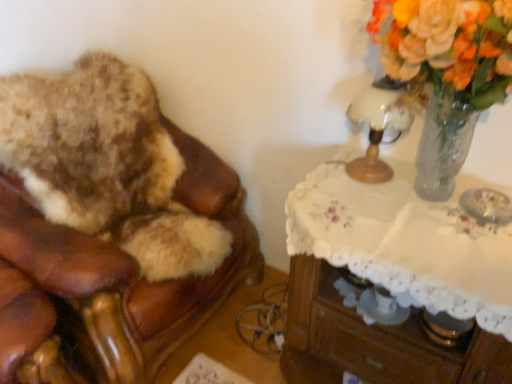
Locate an element on the screen. The height and width of the screenshot is (384, 512). brown leather chair at left is located at coordinates pyautogui.click(x=108, y=228).

Locate an element on the screen. white lace-covered table at upper right is located at coordinates (392, 282).

Who is smaller, white glass table lamp at upper right or brown leather chair at left?

white glass table lamp at upper right.

Are white glass table lamp at upper right and brown leather chair at left far apart?

white glass table lamp at upper right is actually quite close to brown leather chair at left.

Based on the photo, which is closer, (409, 107) or (207, 205)?

The point (409, 107) is closer to the camera.

In the scene shown: From a real-world perspective, is white glass table lamp at upper right located higher than brown leather chair at left?

Yes, from a real-world perspective, white glass table lamp at upper right is on top of brown leather chair at left.

In terms of height, does white glass table lamp at upper right look taller or shorter compared to white lace-covered table at upper right?

Considering their sizes, white glass table lamp at upper right has more height than white lace-covered table at upper right.

Which object is further away from the camera, white glass table lamp at upper right or white lace-covered table at upper right?

white glass table lamp at upper right is further away from the camera.

Looking at this image, from a real-world perspective, is white glass table lamp at upper right on top of white lace-covered table at upper right?

Yes, from a real-world perspective, white glass table lamp at upper right is on top of white lace-covered table at upper right.

What's the angular difference between white glass table lamp at upper right and white lace-covered table at upper right's facing directions?

The angle between the facing direction of white glass table lamp at upper right and the facing direction of white lace-covered table at upper right is 0.581 degrees.

From the image's perspective, which one is positioned higher, white lace-covered table at upper right or translucent glass vase at upper right?

From the image's view, translucent glass vase at upper right is above.

Is white lace-covered table at upper right positioned far away from translucent glass vase at upper right?

That's not correct — white lace-covered table at upper right is a little close to translucent glass vase at upper right.

Which of these two, white lace-covered table at upper right or translucent glass vase at upper right, is thinner?

translucent glass vase at upper right is thinner.

Between point (450, 236) and point (449, 141), which one is positioned behind?

Positioned behind is point (449, 141).

Is brown leather chair at left positioned beyond the bounds of white lace-covered table at upper right?

Indeed, brown leather chair at left is completely outside white lace-covered table at upper right.

Can you tell me how much brown leather chair at left and white lace-covered table at upper right differ in facing direction?

The angular difference between brown leather chair at left and white lace-covered table at upper right is 90 degrees.

Which point is more forward, [80,262] or [471,353]?

Point [471,353]

From the image's perspective, would you say white lace-covered table at upper right is shown under brown leather chair at left?

Yes.

Does white lace-covered table at upper right have a greater height compared to brown leather chair at left?

No.

Is white lace-covered table at upper right wider than brown leather chair at left?

Incorrect, the width of white lace-covered table at upper right does not surpass that of brown leather chair at left.

Is white lace-covered table at upper right not close to brown leather chair at left?

They are positioned close to each other.

Find the location of `floral arrangement in front of the white glass table lamp at upper right`. floral arrangement in front of the white glass table lamp at upper right is located at coordinates (446, 73).

Which object is wider, translucent glass vase at upper right or white glass table lamp at upper right?

Wider between the two is translucent glass vase at upper right.

In the scene shown: Does translucent glass vase at upper right touch white glass table lamp at upper right?

No, translucent glass vase at upper right is not making contact with white glass table lamp at upper right.

Between translucent glass vase at upper right and white glass table lamp at upper right, which one is positioned behind?

white glass table lamp at upper right is further away from the camera.

Is brown leather chair at left wider than translucent glass vase at upper right?

Yes, brown leather chair at left is wider than translucent glass vase at upper right.

Does brown leather chair at left contain translucent glass vase at upper right?

That's incorrect, translucent glass vase at upper right is not inside brown leather chair at left.

Is brown leather chair at left bigger than translucent glass vase at upper right?

Correct, brown leather chair at left is larger in size than translucent glass vase at upper right.

Is brown leather chair at left touching translucent glass vase at upper right?

brown leather chair at left is not next to translucent glass vase at upper right, and they're not touching.

Locate an element on the screen. The width and height of the screenshot is (512, 384). table lamp lying above the brown leather chair at left (from the image's perspective) is located at coordinates (379, 125).

The width and height of the screenshot is (512, 384). I want to click on table lamp located on the left of white lace-covered table at upper right, so click(379, 125).

Estimate the real-world distances between objects in this image. Which object is further from brown leather chair at left, white glass table lamp at upper right or white lace-covered table at upper right?

The object further to brown leather chair at left is white glass table lamp at upper right.

From the image, which object appears to be nearer to white lace-covered table at upper right, translucent glass vase at upper right or white glass table lamp at upper right?

white glass table lamp at upper right is positioned closer to the anchor white lace-covered table at upper right.

Based on their spatial positions, is white lace-covered table at upper right or translucent glass vase at upper right closer to white glass table lamp at upper right?

Based on the image, translucent glass vase at upper right appears to be nearer to white glass table lamp at upper right.

Considering their positions, is brown leather chair at left positioned closer to white lace-covered table at upper right than translucent glass vase at upper right?

translucent glass vase at upper right.

Based on their spatial positions, is white glass table lamp at upper right or translucent glass vase at upper right further from brown leather chair at left?

Based on the image, translucent glass vase at upper right appears to be further to brown leather chair at left.

From the image, which object appears to be nearer to white glass table lamp at upper right, white lace-covered table at upper right or brown leather chair at left?

The object closer to white glass table lamp at upper right is white lace-covered table at upper right.

From the picture: From the image, which object appears to be farther from white glass table lamp at upper right, brown leather chair at left or translucent glass vase at upper right?

brown leather chair at left is further to white glass table lamp at upper right.

Estimate the real-world distances between objects in this image. Which object is closer to translucent glass vase at upper right, white glass table lamp at upper right or brown leather chair at left?

The object closer to translucent glass vase at upper right is white glass table lamp at upper right.

You are a GUI agent. You are given a task and a screenshot of the screen. Output one action in this format:
    pyautogui.click(x=<x>, y=<y>)
    Task: Click on the table lamp located between brown leather chair at left and translucent glass vase at upper right in the left-right direction
    This screenshot has height=384, width=512.
    Given the screenshot: What is the action you would take?
    pyautogui.click(x=379, y=125)

I want to click on table between translucent glass vase at upper right and white glass table lamp at upper right from front to back, so click(x=392, y=282).

The image size is (512, 384). I want to click on table between brown leather chair at left and translucent glass vase at upper right from left to right, so click(392, 282).

You are a GUI agent. You are given a task and a screenshot of the screen. Output one action in this format:
    pyautogui.click(x=<x>, y=<y>)
    Task: Click on the table lamp located between brown leather chair at left and white lace-covered table at upper right in the left-right direction
    The width and height of the screenshot is (512, 384).
    Given the screenshot: What is the action you would take?
    pyautogui.click(x=379, y=125)